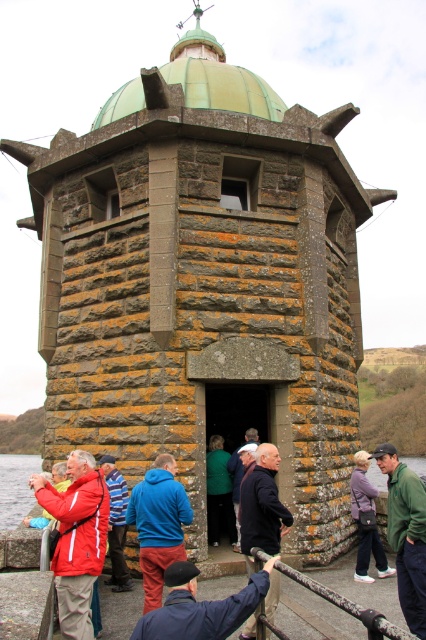
You are standing in front of the stone tower with a green dome roof. You notice a green matte jacket at lower right. If you want to reach the jacket quickly, should you walk towards the tower or away from it?

You should walk towards the tower because the green matte jacket at lower right is 17.70 meters away from the viewer, which is a closer distance than if you walked away from the tower.

You are a tour guide at the watchtower and notice two jackets left near the entrance. The green matte jacket at lower right and the purple fleece jacket at center. Which jacket is bigger?

The green matte jacket at lower right is larger in size compared to the purple fleece jacket at center.

You are a tour guide standing in front of the stone tower with a green dome roof. You notice two jackets hanging on a rack near the entrance. The jackets are the blue fabric jacket at center and the purple fleece jacket at center. Which jacket takes up more space on the rack?

Result: The purple fleece jacket at center takes up more space on the rack than the blue fabric jacket at center because the blue fabric jacket at center occupies less space than the purple fleece jacket at center.